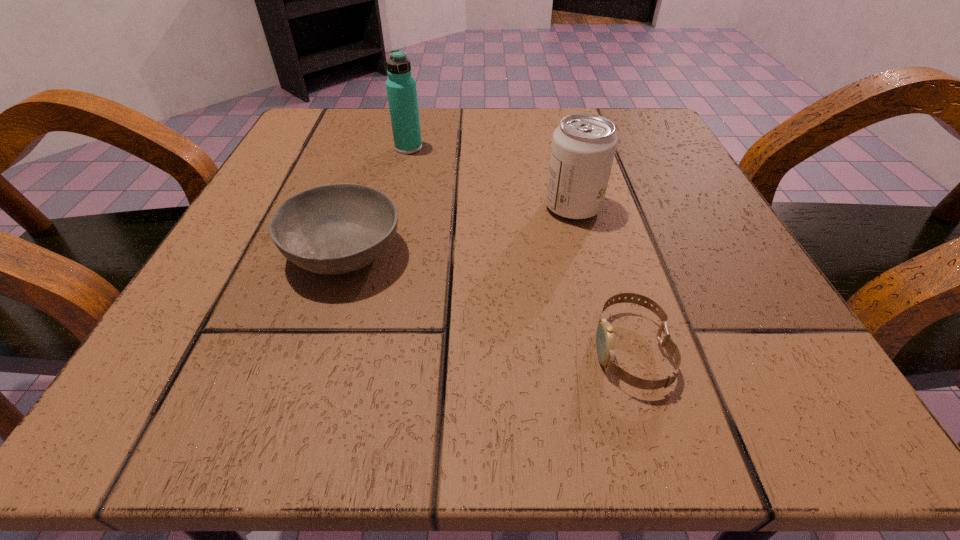
Locate an element on the screen. vacant area at the far left corner of the desktop is located at coordinates (299, 125).

This screenshot has width=960, height=540. In the image, there is a desktop. Identify the location of free space at the near left corner. (275, 399).

Identify the location of vacant point at the far right corner. (585, 112).

The height and width of the screenshot is (540, 960). In the image, there is a desktop. Find the location of `free space at the near right corner`. free space at the near right corner is located at coordinates (715, 389).

This screenshot has height=540, width=960. In order to click on vacant space in between the shortest object and the third tallest object in this screenshot , I will do `click(488, 302)`.

Find the location of a particular element. Image resolution: width=960 pixels, height=540 pixels. blank region between the shortest object and the soda can is located at coordinates (602, 279).

Find the location of a particular element. This screenshot has height=540, width=960. vacant space that's between the farthest object and the soda can is located at coordinates (491, 178).

Identify the location of free space between the farthest object and the third shortest object. (491, 178).

Where is `empty location between the third tallest object and the shortest object`? The image size is (960, 540). empty location between the third tallest object and the shortest object is located at coordinates (488, 302).

Image resolution: width=960 pixels, height=540 pixels. I want to click on vacant area that lies between the farthest object and the shortest object, so click(x=520, y=249).